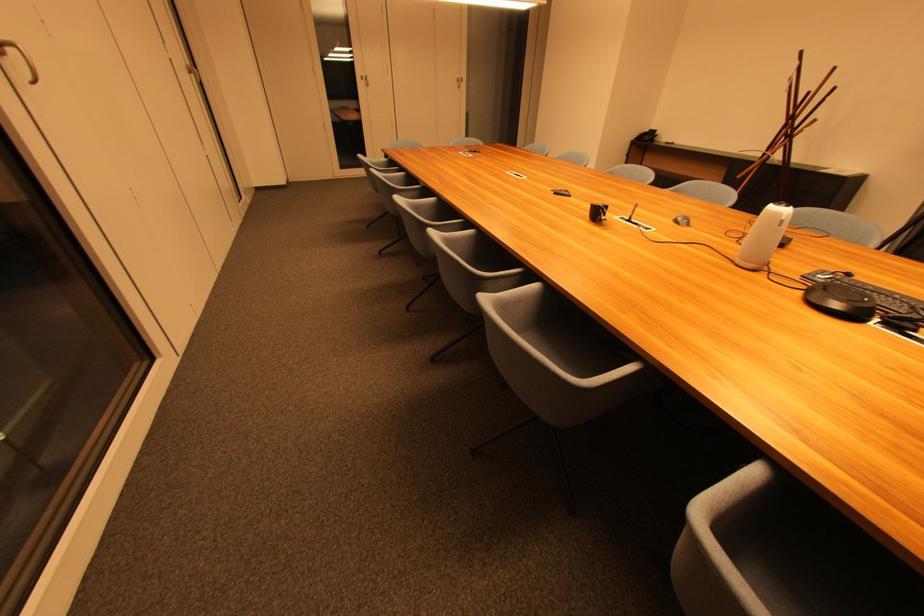
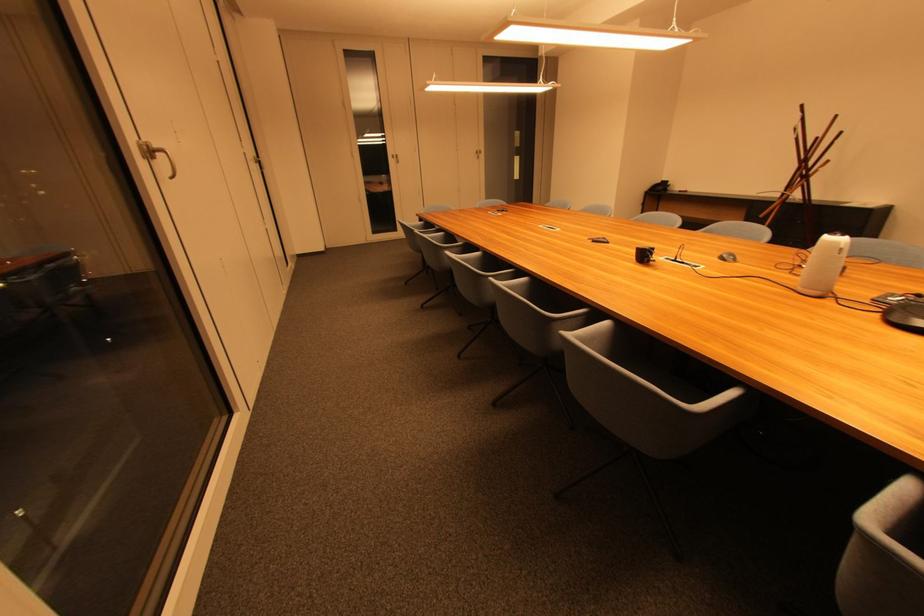
Find the pixel in the second image that matches the point at 472,225 in the first image.

(525, 274)